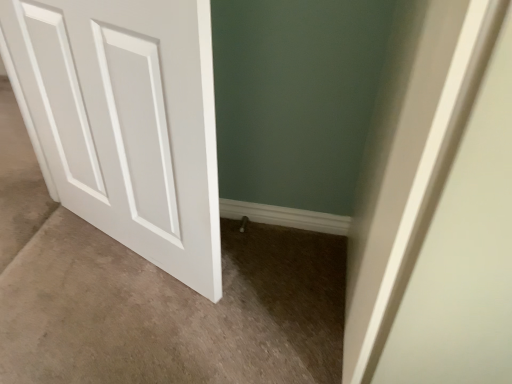
Identify the location of white matte door at left. (126, 121).

The image size is (512, 384). What do you see at coordinates (126, 121) in the screenshot?
I see `white matte door at left` at bounding box center [126, 121].

The image size is (512, 384). Find the location of `white matte door at left`. white matte door at left is located at coordinates (126, 121).